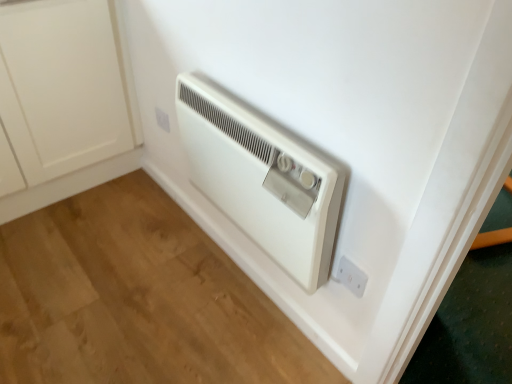
Question: Should I look upward or downward to see white plastic electric outlet at lower right, the first electric outlet from the front?

Choices:
 (A) down
 (B) up

Answer: (A)

Question: Should I look upward or downward to see white plastic electric outlet at lower center, acting as the 1th electric outlet starting from the left?

Choices:
 (A) up
 (B) down

Answer: (A)

Question: Considering the relative sizes of white plastic electric outlet at lower right, which is the second electric outlet in left-to-right order, and white matte cabinet at lower left in the image provided, is white plastic electric outlet at lower right, which is the second electric outlet in left-to-right order, smaller than white matte cabinet at lower left?

Choices:
 (A) no
 (B) yes

Answer: (B)

Question: Would you say white matte cabinet at lower left is part of white plastic electric outlet at lower right, positioned as the 2th electric outlet in back-to-front order,'s contents?

Choices:
 (A) no
 (B) yes

Answer: (A)

Question: Does white plastic electric outlet at lower right, positioned as the first electric outlet in right-to-left order, have a larger size compared to white matte cabinet at lower left?

Choices:
 (A) no
 (B) yes

Answer: (A)

Question: From the image's perspective, would you say white plastic electric outlet at lower right, positioned as the first electric outlet in right-to-left order, is shown under white matte cabinet at lower left?

Choices:
 (A) no
 (B) yes

Answer: (B)

Question: From the image's perspective, is white plastic electric outlet at lower right, which is the 2th electric outlet in top-to-bottom order, on top of white matte cabinet at lower left?

Choices:
 (A) yes
 (B) no

Answer: (B)

Question: Is white plastic electric outlet at lower right, which is the second electric outlet in left-to-right order, facing towards white matte cabinet at lower left?

Choices:
 (A) no
 (B) yes

Answer: (A)

Question: Are white plastic heater at center and white matte cabinet at lower left far apart?

Choices:
 (A) yes
 (B) no

Answer: (B)

Question: Can you confirm if white plastic heater at center is positioned to the left of white matte cabinet at lower left?

Choices:
 (A) no
 (B) yes

Answer: (A)

Question: Does white plastic heater at center have a greater width compared to white matte cabinet at lower left?

Choices:
 (A) yes
 (B) no

Answer: (B)

Question: Is white plastic heater at center closer to the viewer compared to white matte cabinet at lower left?

Choices:
 (A) yes
 (B) no

Answer: (A)

Question: Is white plastic heater at center taller than white matte cabinet at lower left?

Choices:
 (A) yes
 (B) no

Answer: (B)

Question: Is white plastic heater at center aimed at white matte cabinet at lower left?

Choices:
 (A) yes
 (B) no

Answer: (B)

Question: Is white plastic electric outlet at lower right, positioned as the first electric outlet in right-to-left order, taller than white plastic electric outlet at lower center, arranged as the second electric outlet when viewed from the right?

Choices:
 (A) no
 (B) yes

Answer: (B)